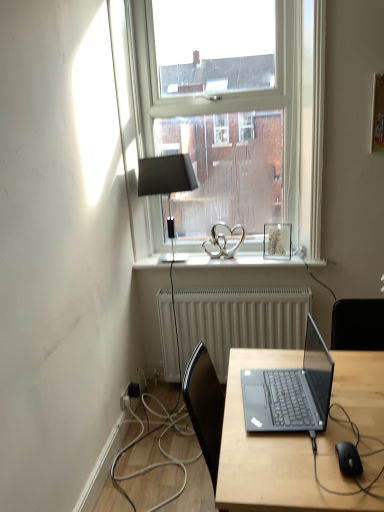
Image resolution: width=384 pixels, height=512 pixels. What do you see at coordinates (291, 391) in the screenshot? I see `sleek black laptop at center` at bounding box center [291, 391].

Locate an element on the screen. sleek black laptop at center is located at coordinates (291, 391).

What is the approximate width of clear glass window at upper center?

5.10 inches.

The height and width of the screenshot is (512, 384). What do you see at coordinates (277, 240) in the screenshot?
I see `matte silver picture frame at upper right` at bounding box center [277, 240].

What do you see at coordinates (349, 457) in the screenshot? I see `black rubber cable at lower right` at bounding box center [349, 457].

Image resolution: width=384 pixels, height=512 pixels. What do you see at coordinates (165, 175) in the screenshot? I see `matte black lamp at upper center` at bounding box center [165, 175].

This screenshot has width=384, height=512. In order to click on white glossy window sill at center in this screenshot , I will do `click(242, 261)`.

At what (x,y) coordinates should I click in order to perform the action: click on black matte computer mouse at lower right. Please return your answer as a coordinate pair (x, y). Looking at the image, I should click on (348, 459).

The image size is (384, 512). Identify the location of matte black laptop at center. (270, 454).

Between black matte computer mouse at lower right and clear glass window at upper center, which one is positioned in front?

Positioned in front is black matte computer mouse at lower right.

Considering the sizes of black matte computer mouse at lower right and clear glass window at upper center in the image, is black matte computer mouse at lower right bigger or smaller than clear glass window at upper center?

black matte computer mouse at lower right is smaller than clear glass window at upper center.

Is black matte computer mouse at lower right shorter than clear glass window at upper center?

Yes, black matte computer mouse at lower right is shorter than clear glass window at upper center.

Considering the relative positions of black matte computer mouse at lower right and clear glass window at upper center in the image provided, is black matte computer mouse at lower right to the left or to the right of clear glass window at upper center?

black matte computer mouse at lower right is positioned on clear glass window at upper center's right side.

From the image's perspective, is sleek black laptop at center above matte black laptop at center?

Yes, from the image's perspective, sleek black laptop at center is over matte black laptop at center.

Considering their positions, is sleek black laptop at center located in front of or behind matte black laptop at center?

Clearly, sleek black laptop at center is behind matte black laptop at center.

Does sleek black laptop at center appear on the right side of matte black laptop at center?

No, sleek black laptop at center is not to the right of matte black laptop at center.

Considering the relative sizes of sleek black laptop at center and matte black laptop at center in the image provided, is sleek black laptop at center wider than matte black laptop at center?

In fact, sleek black laptop at center might be narrower than matte black laptop at center.

Can you confirm if matte black lamp at upper center is wider than matte black laptop at center?

Incorrect, the width of matte black lamp at upper center does not surpass that of matte black laptop at center.

Is matte black lamp at upper center not close to matte black laptop at center?

Yes, matte black lamp at upper center and matte black laptop at center are located far from each other.

Is matte black lamp at upper center inside or outside of matte black laptop at center?

matte black lamp at upper center is outside matte black laptop at center.

From a real-world perspective, which is physically above, matte black lamp at upper center or matte black laptop at center?

matte black lamp at upper center is physically above.

Considering the positions of point (151, 157) and point (215, 259), is point (151, 157) closer or farther from the camera than point (215, 259)?

Point (151, 157) appears to be closer to the viewer than point (215, 259).

From the image's perspective, which one is positioned higher, matte black lamp at upper center or white glossy window sill at center?

matte black lamp at upper center.

Does matte black lamp at upper center have a smaller size compared to white glossy window sill at center?

No.

Does matte black lamp at upper center turn towards white glossy window sill at center?

No, matte black lamp at upper center is not facing towards white glossy window sill at center.

Which object is positioned more to the left, black matte computer mouse at lower right or matte black lamp at upper center?

matte black lamp at upper center is more to the left.

At what (x,y) coordinates should I click in order to perform the action: click on lamp on the left of black matte computer mouse at lower right. Please return your answer as a coordinate pair (x, y). The image size is (384, 512). Looking at the image, I should click on (165, 175).

From the image's perspective, is black matte computer mouse at lower right located above matte black lamp at upper center?

No.

Is black matte computer mouse at lower right facing towards matte black lamp at upper center?

No, black matte computer mouse at lower right does not turn towards matte black lamp at upper center.

Identify the location of laptop lying on the left of matte black laptop at center. (291, 391).

Is matte black laptop at center with sleek black laptop at center?

Yes, matte black laptop at center and sleek black laptop at center clearly make contact.

What's the angular difference between black matte computer mouse at lower right and black rubber cable at lower right's facing directions?

The angle between the facing direction of black matte computer mouse at lower right and the facing direction of black rubber cable at lower right is 177 degrees.

Between black matte computer mouse at lower right and black rubber cable at lower right, which one has larger width?

black rubber cable at lower right is wider.

Which of these two, black matte computer mouse at lower right or black rubber cable at lower right, stands taller?

With more height is black rubber cable at lower right.

Would you say black matte computer mouse at lower right is to the left or to the right of black rubber cable at lower right in the picture?

Clearly, black matte computer mouse at lower right is on the left of black rubber cable at lower right in the image.

Find the location of a particular element. This screenshot has width=384, height=512. window to the left of black matte computer mouse at lower right is located at coordinates (232, 106).

The width and height of the screenshot is (384, 512). There is a matte black laptop at center. What are the coordinates of `laptop above it (from a real-world perspective)` in the screenshot? It's located at (291, 391).

From the image, which object appears to be nearer to matte silver picture frame at upper right, clear glass window at upper center or matte black laptop at center?

The object closer to matte silver picture frame at upper right is clear glass window at upper center.

When comparing their distances from clear glass window at upper center, does white glossy window sill at center or black matte computer mouse at lower right seem closer?

Among the two, white glossy window sill at center is located nearer to clear glass window at upper center.

Considering their positions, is sleek black laptop at center positioned closer to clear glass window at upper center than matte black lamp at upper center?

matte black lamp at upper center is positioned closer to the anchor clear glass window at upper center.

Estimate the real-world distances between objects in this image. Which object is further from black matte computer mouse at lower right, matte black lamp at upper center or white glossy window sill at center?

matte black lamp at upper center is further to black matte computer mouse at lower right.

From the image, which object appears to be farther from white textured radiator at center, white glossy window sill at center or matte silver picture frame at upper right?

matte silver picture frame at upper right.

When comparing their distances from white glossy window sill at center, does matte black lamp at upper center or black rubber cable at lower right seem further?

Among the two, black rubber cable at lower right is located further to white glossy window sill at center.

Based on their spatial positions, is clear glass window at upper center or white textured radiator at center further from matte silver picture frame at upper right?

clear glass window at upper center is positioned further to the anchor matte silver picture frame at upper right.

Estimate the real-world distances between objects in this image. Which object is closer to white textured radiator at center, matte silver picture frame at upper right or clear glass window at upper center?

Among the two, matte silver picture frame at upper right is located nearer to white textured radiator at center.

Find the location of `radiator between clear glass window at upper center and black matte computer mouse at lower right in the up-down direction`. radiator between clear glass window at upper center and black matte computer mouse at lower right in the up-down direction is located at coordinates (240, 321).

Image resolution: width=384 pixels, height=512 pixels. I want to click on radiator located between matte black laptop at center and white glossy window sill at center in the depth direction, so click(240, 321).

You are a GUI agent. You are given a task and a screenshot of the screen. Output one action in this format:
    pyautogui.click(x=<x>, y=<y>)
    Task: Click on the computer mouse that lies between sleek black laptop at center and matte black laptop at center from top to bottom
    This screenshot has width=384, height=512.
    Given the screenshot: What is the action you would take?
    pyautogui.click(x=348, y=459)

This screenshot has width=384, height=512. Find the location of `computer mouse located between matte black laptop at center and white glossy window sill at center in the depth direction`. computer mouse located between matte black laptop at center and white glossy window sill at center in the depth direction is located at coordinates (348, 459).